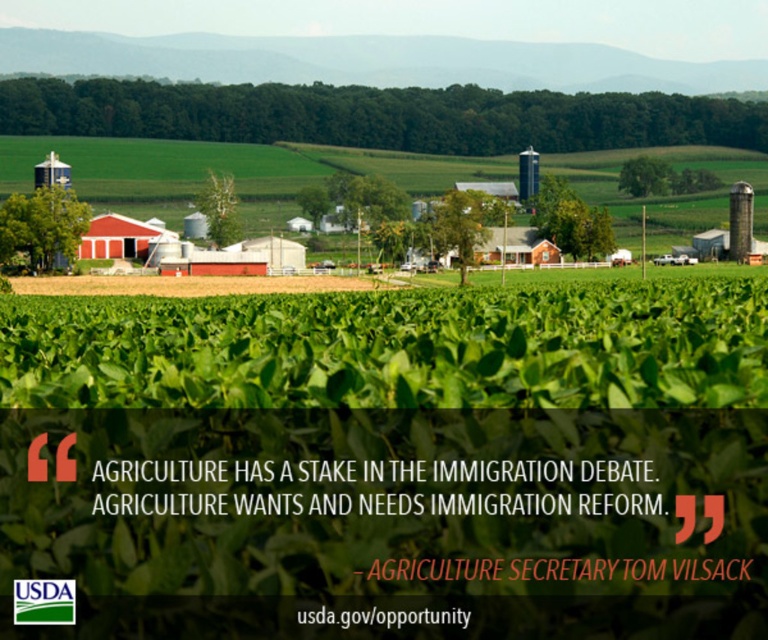
You are a farmer planning to install a new fence around the matte red barn at center and the metallic silver silo at center. To ensure the fence is large enough, which object requires a larger fence in terms of width?

The matte red barn at center might be wider than metallic silver silo at center, so it requires a larger fence in terms of width.